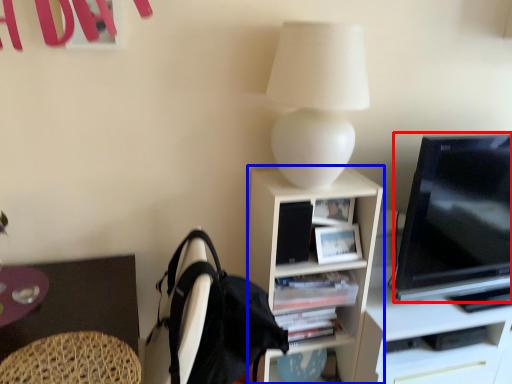
Question: Which object appears farthest to the camera in this image, television (highlighted by a red box) or shelf (highlighted by a blue box)?

Choices:
 (A) television
 (B) shelf

Answer: (B)